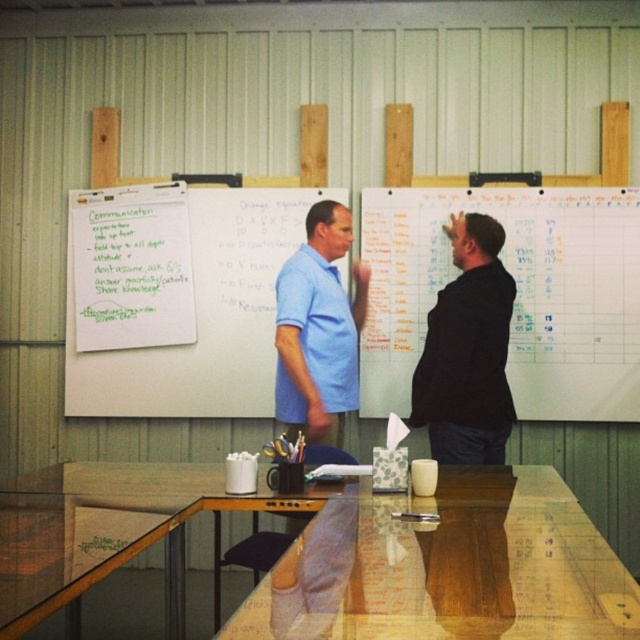
You are an office manager planning to hang a new poster that requires 1.2 meters of width. You have two options on the wall where the whiteboard at upper right and the white paperboard at upper left are currently placed. Which board should you remove to accommodate the poster?

The white paperboard at upper left has a greater width than the whiteboard at upper right. Therefore, removing the white paperboard at upper left would provide more space to accommodate the poster requiring 1.2 meters of width.

You are an office assistant who needs to present a report. You are standing at the light blue cotton shirt at center. Which direction should you face to see the white paperboard at upper left without moving your position?

The white paperboard at upper left is to the left of the light blue cotton shirt at center, so you should face to your left to see it without moving.